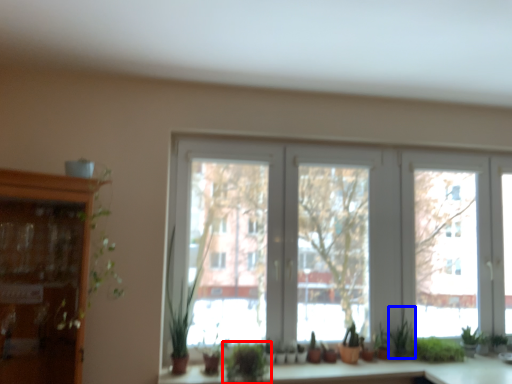
Question: Which object is closer to the camera taking this photo, houseplant (highlighted by a red box) or plant (highlighted by a blue box)?

Choices:
 (A) houseplant
 (B) plant

Answer: (A)